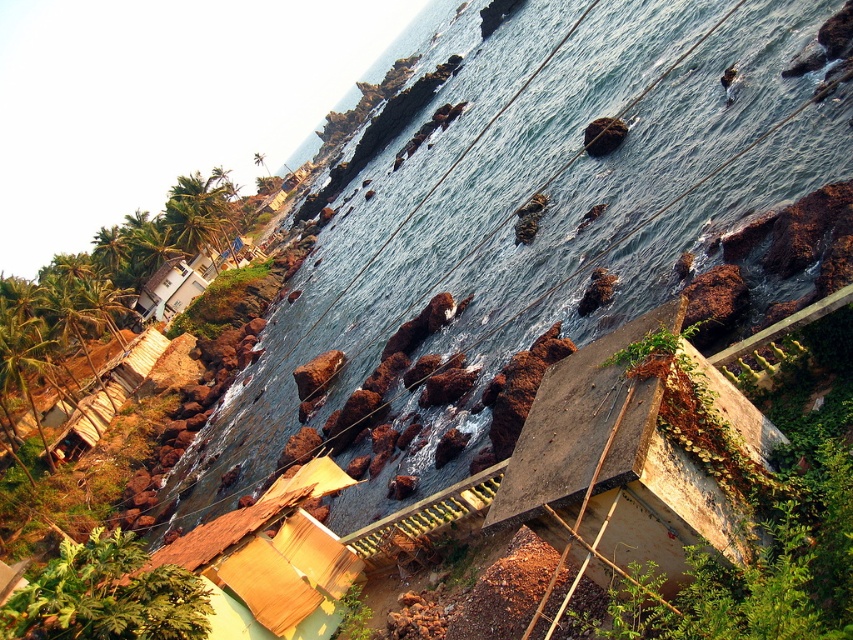
Does rusty corrugated metal hut at lower right have a larger size compared to brown woven mat at lower left?

No, rusty corrugated metal hut at lower right is not bigger than brown woven mat at lower left.

Who is more forward, (x=585, y=467) or (x=334, y=577)?

Point (x=585, y=467) is more forward.

Find the location of a particular element. rusty corrugated metal hut at lower right is located at coordinates point(612,467).

Can you confirm if blue water at center is positioned above rusty corrugated metal hut at lower right?

Correct, blue water at center is located above rusty corrugated metal hut at lower right.

Can you confirm if blue water at center is bigger than rusty corrugated metal hut at lower right?

Yes, blue water at center is bigger than rusty corrugated metal hut at lower right.

Which is behind, point (519, 125) or point (538, 396)?

The point (519, 125) is behind.

Identify the location of blue water at center. (527, 196).

Is blue water at center taller than white matte house at upper left?

Correct, blue water at center is much taller as white matte house at upper left.

Can you confirm if blue water at center is positioned above white matte house at upper left?

Yes.

This screenshot has height=640, width=853. What do you see at coordinates (527, 196) in the screenshot?
I see `blue water at center` at bounding box center [527, 196].

Find the location of `blue water at center`. blue water at center is located at coordinates (527, 196).